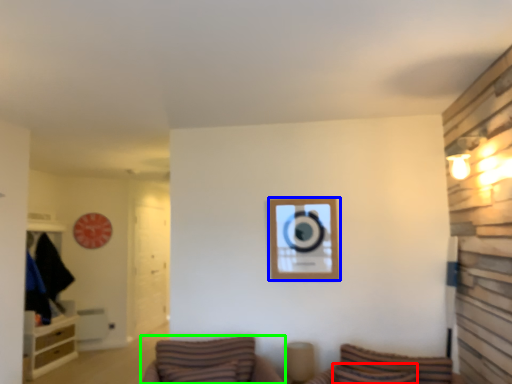
Question: Which is nearer to the pillow (highlighted by a red box)? picture frame (highlighted by a blue box) or furniture (highlighted by a green box).

Choices:
 (A) picture frame
 (B) furniture

Answer: (B)